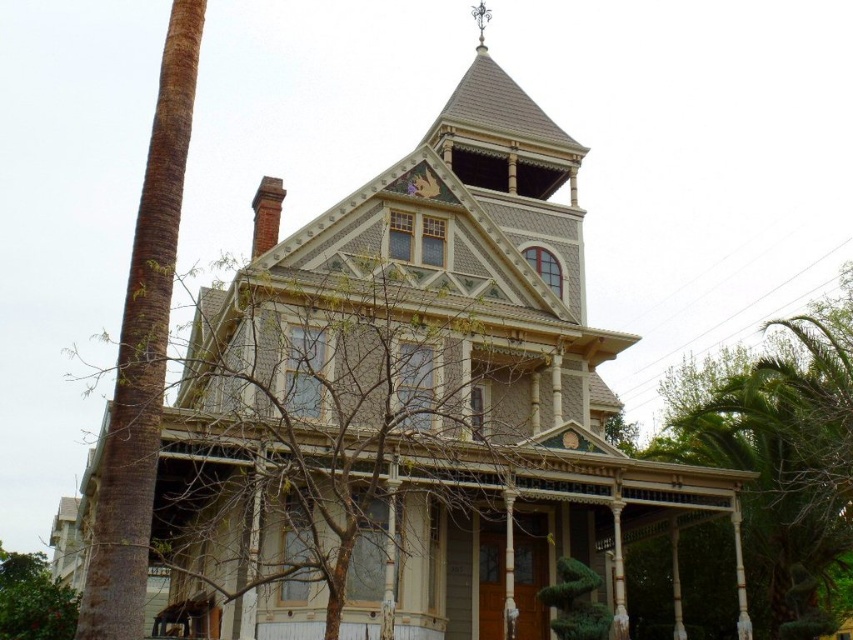
Question: Is wooden porch at center to the left of green leafy tree at lower left from the viewer's perspective?

Choices:
 (A) no
 (B) yes

Answer: (A)

Question: Does bare branches at upper center appear on the left side of green leafy tree at lower right?

Choices:
 (A) no
 (B) yes

Answer: (B)

Question: Which of the following is the farthest from the observer?

Choices:
 (A) (18, 630)
 (B) (257, 298)
 (C) (695, 369)
 (D) (196, 506)

Answer: (C)

Question: Which object is positioned farthest from the green leafy tree at lower right?

Choices:
 (A) wooden porch at center
 (B) green leafy tree at lower left

Answer: (B)

Question: Which point is closer to the camera?

Choices:
 (A) (224, 522)
 (B) (753, 465)
 (C) (16, 556)
 (D) (408, 522)

Answer: (D)

Question: Can you confirm if wooden porch at center is bigger than bare branches at upper center?

Choices:
 (A) yes
 (B) no

Answer: (A)